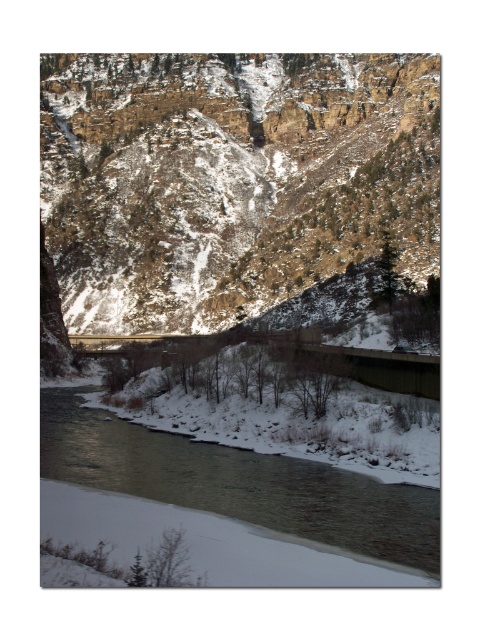
Is rocky brown cliff at center bigger than snowy river at lower center?

Indeed, rocky brown cliff at center has a larger size compared to snowy river at lower center.

Looking at this image, who is more distant from viewer, (157, 156) or (240, 484)?

Point (157, 156)

In order to click on rocky brown cliff at center in this screenshot , I will do `click(230, 179)`.